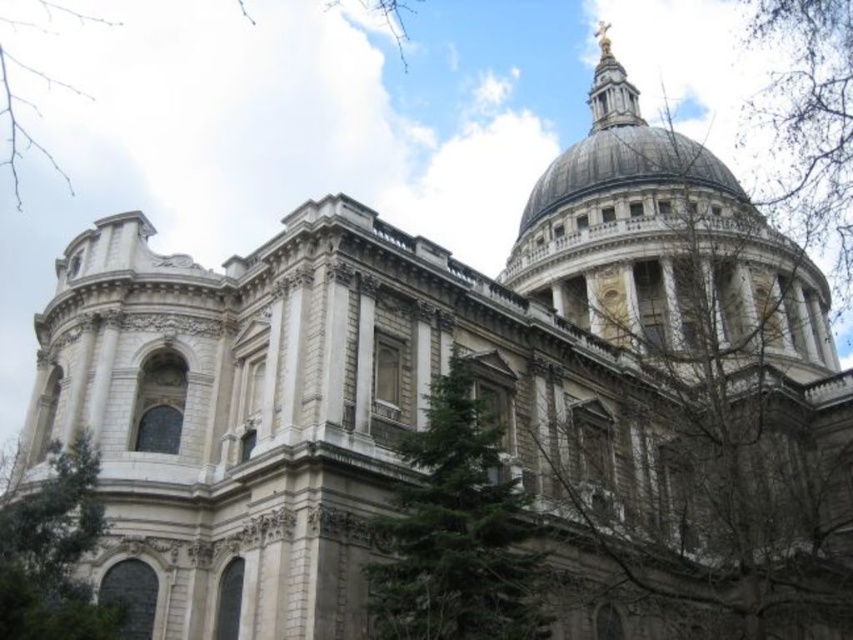
You are a photographer standing in front of St. Paul Cathedral. You notice a green textured tree at center and bare branches at upper right. Which object is closer to you, the photographer?

The green textured tree at center is closer to you because it is in front of the bare branches at upper right.

You are a landscape architect reviewing a design plan for a park near St. Paul Cathedral. The design includes a green textured tree at center and bare branches at upper right. Which of the two elements is shorter in the design?

The green textured tree at center is shorter than the bare branches at upper right.

You are standing in the courtyard of St. Paul Cathedral and see the green textured tree at center and the green leafy tree at upper center. Which tree is closer to your left side?

The green leafy tree at upper center is closer to your left side because the green textured tree at center is positioned on the right side of it.